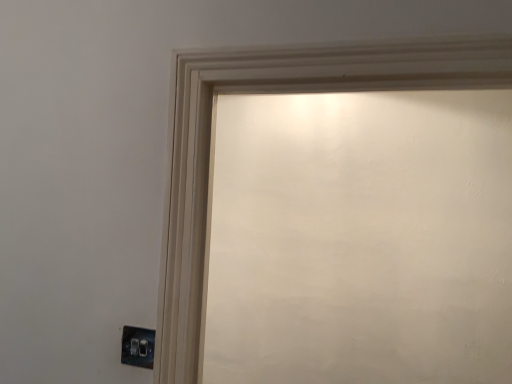
What is the approximate width of satin silver switch at lower left?

It is 0.86 inches.

The width and height of the screenshot is (512, 384). In order to click on satin silver switch at lower left in this screenshot , I will do `click(138, 347)`.

What do you see at coordinates (138, 347) in the screenshot? This screenshot has width=512, height=384. I see `satin silver switch at lower left` at bounding box center [138, 347].

This screenshot has width=512, height=384. In order to click on satin silver switch at lower left in this screenshot , I will do [x=138, y=347].